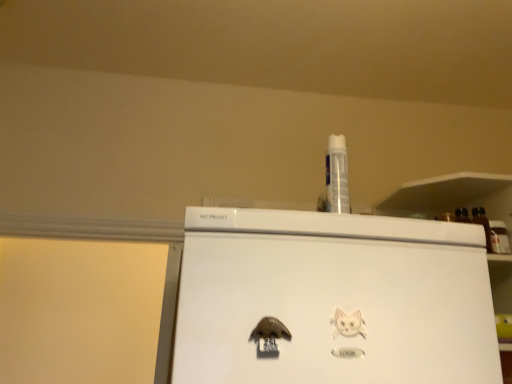
Question: Which direction should I rotate to look at brown matte magnet at lower center, which is counted as the 1th animal, starting from the left?

Choices:
 (A) left
 (B) right

Answer: (B)

Question: Should I look upward or downward to see white paper cat at lower right, which is the first animal from right to left?

Choices:
 (A) up
 (B) down

Answer: (B)

Question: Is brown matte magnet at lower center, which is counted as the 1th animal, starting from the left, far away from white paper cat at lower right, which ranks as the 2th animal in left-to-right order?

Choices:
 (A) yes
 (B) no

Answer: (B)

Question: Is brown matte magnet at lower center, acting as the second animal starting from the right, not inside white paper cat at lower right, which ranks as the 2th animal in left-to-right order?

Choices:
 (A) no
 (B) yes

Answer: (B)

Question: Can you confirm if brown matte magnet at lower center, acting as the second animal starting from the right, is bigger than white paper cat at lower right, which is the first animal from right to left?

Choices:
 (A) no
 (B) yes

Answer: (B)

Question: Considering the relative positions of brown matte magnet at lower center, which is counted as the 1th animal, starting from the left, and white paper cat at lower right, which ranks as the 2th animal in left-to-right order, in the image provided, is brown matte magnet at lower center, which is counted as the 1th animal, starting from the left, to the right of white paper cat at lower right, which ranks as the 2th animal in left-to-right order, from the viewer's perspective?

Choices:
 (A) yes
 (B) no

Answer: (B)

Question: Can you confirm if brown matte magnet at lower center, acting as the second animal starting from the right, is positioned to the left of white paper cat at lower right, which is the first animal from right to left?

Choices:
 (A) yes
 (B) no

Answer: (A)

Question: Can you confirm if brown matte magnet at lower center, which is counted as the 1th animal, starting from the left, is thinner than white paper cat at lower right, which is the first animal from right to left?

Choices:
 (A) yes
 (B) no

Answer: (B)

Question: From a real-world perspective, is white paper cat at lower right, which ranks as the 2th animal in left-to-right order, under brown matte magnet at lower center, which is counted as the 1th animal, starting from the left?

Choices:
 (A) no
 (B) yes

Answer: (A)

Question: Considering the relative sizes of white paper cat at lower right, which ranks as the 2th animal in left-to-right order, and brown matte magnet at lower center, which is counted as the 1th animal, starting from the left, in the image provided, is white paper cat at lower right, which ranks as the 2th animal in left-to-right order, bigger than brown matte magnet at lower center, which is counted as the 1th animal, starting from the left,?

Choices:
 (A) yes
 (B) no

Answer: (B)

Question: Does white paper cat at lower right, which is the first animal from right to left, have a lesser width compared to brown matte magnet at lower center, which is counted as the 1th animal, starting from the left?

Choices:
 (A) yes
 (B) no

Answer: (A)

Question: Is white paper cat at lower right, which is the first animal from right to left, facing towards brown matte magnet at lower center, which is counted as the 1th animal, starting from the left?

Choices:
 (A) no
 (B) yes

Answer: (A)

Question: Considering the relative positions of white paper cat at lower right, which ranks as the 2th animal in left-to-right order, and brown matte magnet at lower center, which is counted as the 1th animal, starting from the left, in the image provided, is white paper cat at lower right, which ranks as the 2th animal in left-to-right order, to the right of brown matte magnet at lower center, which is counted as the 1th animal, starting from the left, from the viewer's perspective?

Choices:
 (A) yes
 (B) no

Answer: (A)

Question: Is white paper cat at lower right, which ranks as the 2th animal in left-to-right order, oriented away from brown matte magnet at lower center, acting as the second animal starting from the right?

Choices:
 (A) no
 (B) yes

Answer: (A)

Question: Would you say white paper cat at lower right, which is the first animal from right to left, is to the left or to the right of brown matte magnet at lower center, which is counted as the 1th animal, starting from the left, in the picture?

Choices:
 (A) right
 (B) left

Answer: (A)